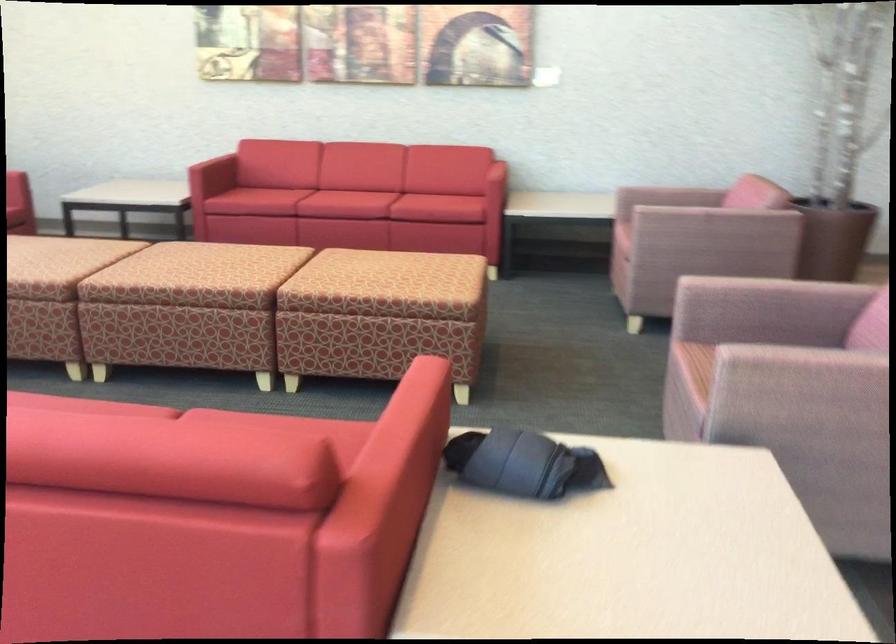
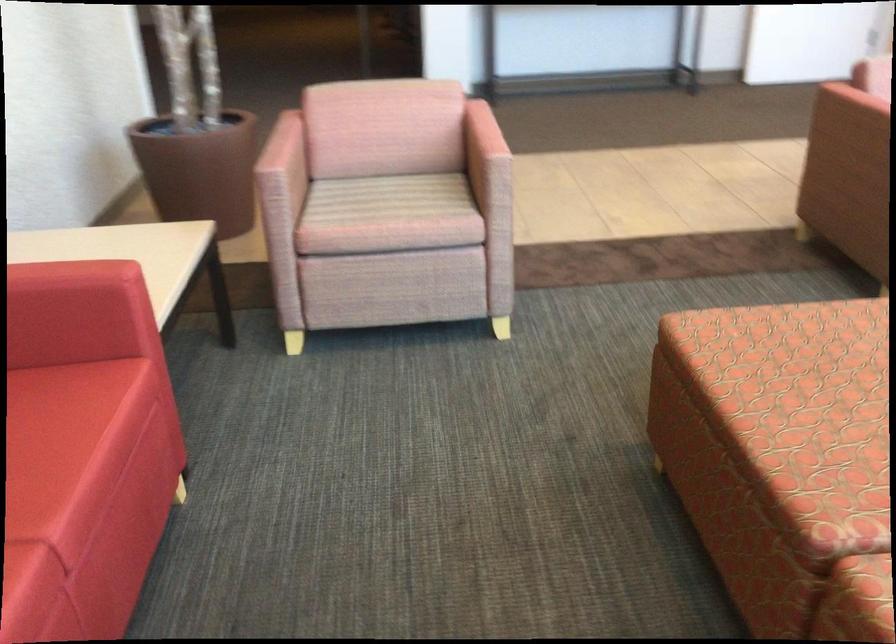
Where in the second image is the point corresponding to pixel 490 173 from the first image?

(156, 303)